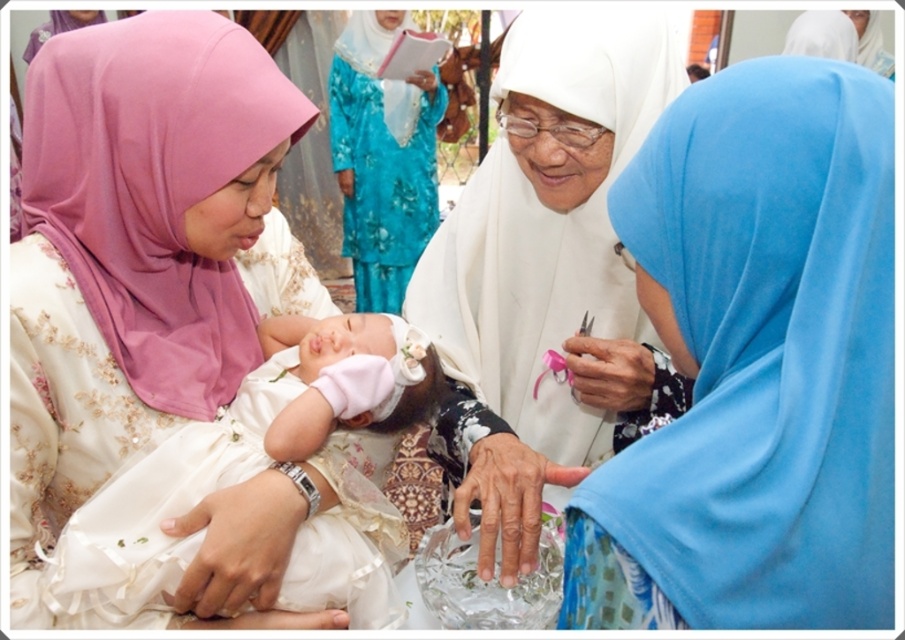
Question: Is blue fabric headscarf at right above white satin hand at center?

Choices:
 (A) no
 (B) yes

Answer: (B)

Question: Which point is closer to the camera taking this photo?

Choices:
 (A) [303, 385]
 (B) [478, 244]
 (C) [589, 337]

Answer: (A)

Question: Is blue floral dress at upper center to the left of white satin hand at center from the viewer's perspective?

Choices:
 (A) yes
 (B) no

Answer: (A)

Question: Which point is farther from the camera taking this photo?

Choices:
 (A) (240, 454)
 (B) (493, 465)
 (C) (249, 563)

Answer: (B)

Question: Considering the relative positions of white satin hijab at center and white satin hand at center in the image provided, where is white satin hijab at center located with respect to white satin hand at center?

Choices:
 (A) below
 (B) above

Answer: (B)

Question: Which point is farther to the camera?

Choices:
 (A) matte pink hijab at upper left
 (B) blue floral dress at upper center
 (C) white satin hijab at center
 (D) dry skin hand at center

Answer: (B)